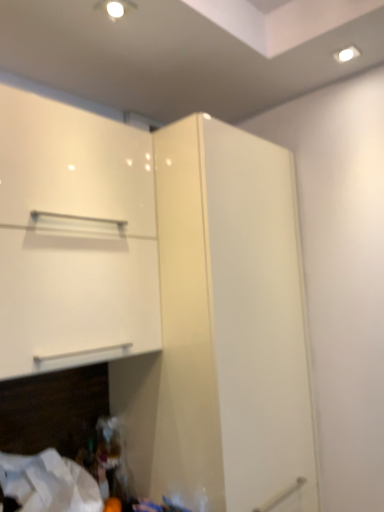
Question: In terms of size, does glossy white cupboard at upper center appear bigger or smaller than white fabric at lower left?

Choices:
 (A) small
 (B) big

Answer: (B)

Question: From a real-world perspective, is glossy white cupboard at upper center positioned above or below white fabric at lower left?

Choices:
 (A) below
 (B) above

Answer: (B)

Question: Estimate the real-world distances between objects in this image. Which object is closer to the white glossy cabinet at upper left?

Choices:
 (A) white fabric at lower left
 (B) glossy white cupboard at upper center

Answer: (B)

Question: Estimate the real-world distances between objects in this image. Which object is farther from the glossy white cupboard at upper center?

Choices:
 (A) white fabric at lower left
 (B) white glossy cabinet at upper left

Answer: (A)